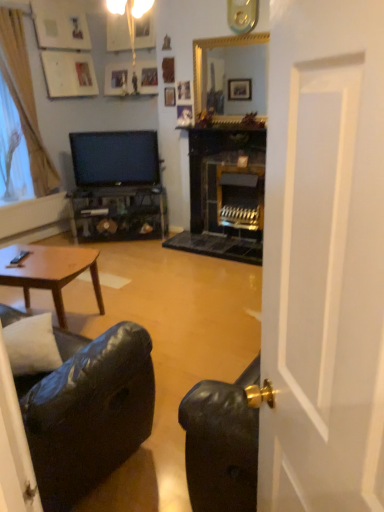
I want to click on free space below gold-framed mirror at upper center (from a real-world perspective), so click(227, 125).